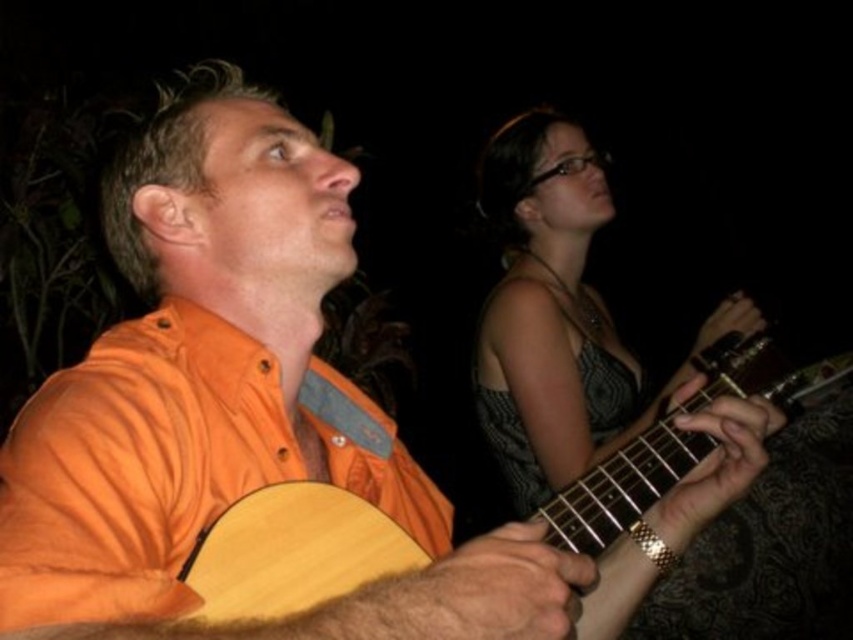
Question: Observing the image, what is the correct spatial positioning of matte gray dress at upper right in reference to wooden acoustic guitar at center?

Choices:
 (A) above
 (B) below

Answer: (A)

Question: From the image, what is the correct spatial relationship of matte gray dress at upper right in relation to wooden acoustic guitar at center?

Choices:
 (A) right
 (B) left

Answer: (A)

Question: Is matte gray dress at upper right below wooden acoustic guitar at center?

Choices:
 (A) no
 (B) yes

Answer: (A)

Question: Which point is closer to the camera?

Choices:
 (A) matte gray dress at upper right
 (B) wooden acoustic guitar at center

Answer: (B)

Question: Which point is closer to the camera taking this photo?

Choices:
 (A) (634, 506)
 (B) (543, 161)

Answer: (A)